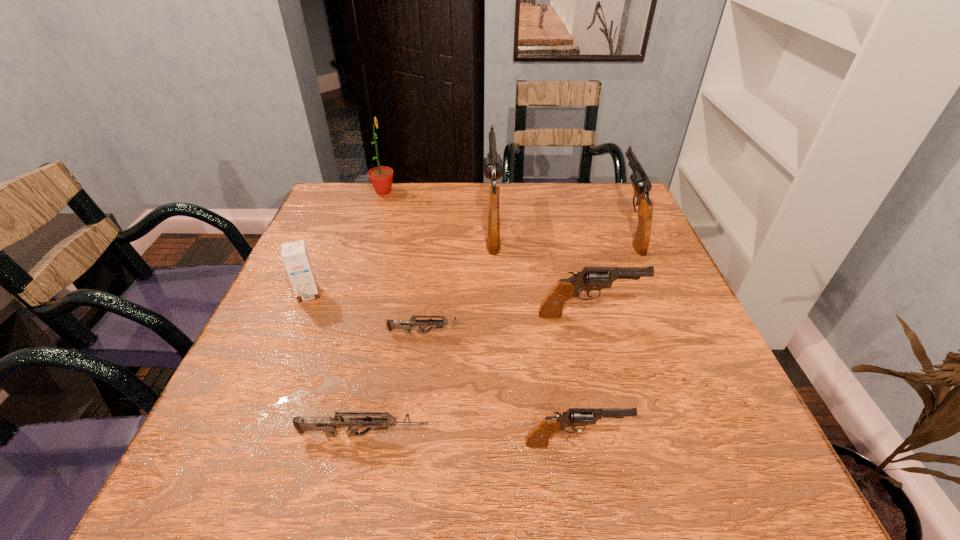
Where is `the fourth tallest gun`? The height and width of the screenshot is (540, 960). the fourth tallest gun is located at coordinates (538, 438).

This screenshot has height=540, width=960. What are the coordinates of `the second shortest object` in the screenshot? It's located at (328, 425).

Image resolution: width=960 pixels, height=540 pixels. I want to click on the fifth tallest gun, so click(x=328, y=425).

You are a GUI agent. You are given a task and a screenshot of the screen. Output one action in this format:
    pyautogui.click(x=<x>, y=<y>)
    Task: Click on the smaller grey gun
    The width and height of the screenshot is (960, 540).
    Given the screenshot: What is the action you would take?
    pyautogui.click(x=391, y=324)

Where is `the shortest object`? Image resolution: width=960 pixels, height=540 pixels. the shortest object is located at coordinates (391, 324).

At what (x,y) coordinates should I click in order to perform the action: click on vacant space located on the face of the sunflower. Please return your answer as a coordinate pair (x, y). The image size is (960, 540). Looking at the image, I should click on (492, 192).

This screenshot has width=960, height=540. Identify the location of free space located along the barrel of the third smallest black gun. (612, 189).

Image resolution: width=960 pixels, height=540 pixels. Identify the location of vacant space located 0.060m on the back of the brown chocolate milk. (320, 269).

Identify the location of vacant point located along the barrel of the fourth shortest gun. The image size is (960, 540). (686, 315).

Locate an element on the screen. The height and width of the screenshot is (540, 960). vacant region located along the barrel of the smallest black gun is located at coordinates (722, 443).